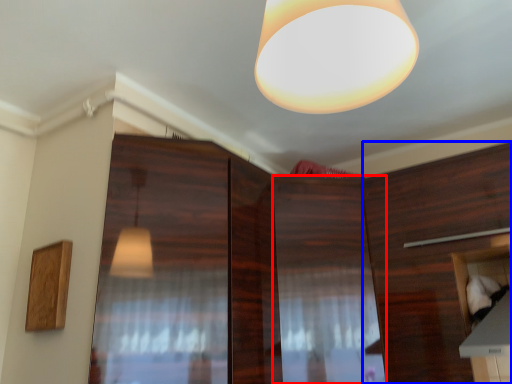
Question: Among these objects, which one is nearest to the camera, cabinetry (highlighted by a red box) or cabinetry (highlighted by a blue box)?

Choices:
 (A) cabinetry
 (B) cabinetry

Answer: (B)